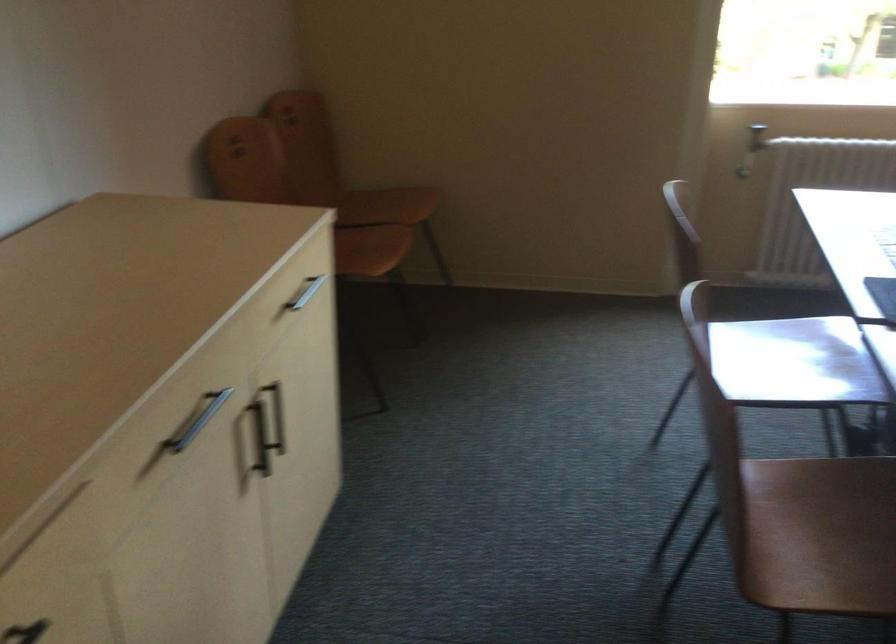
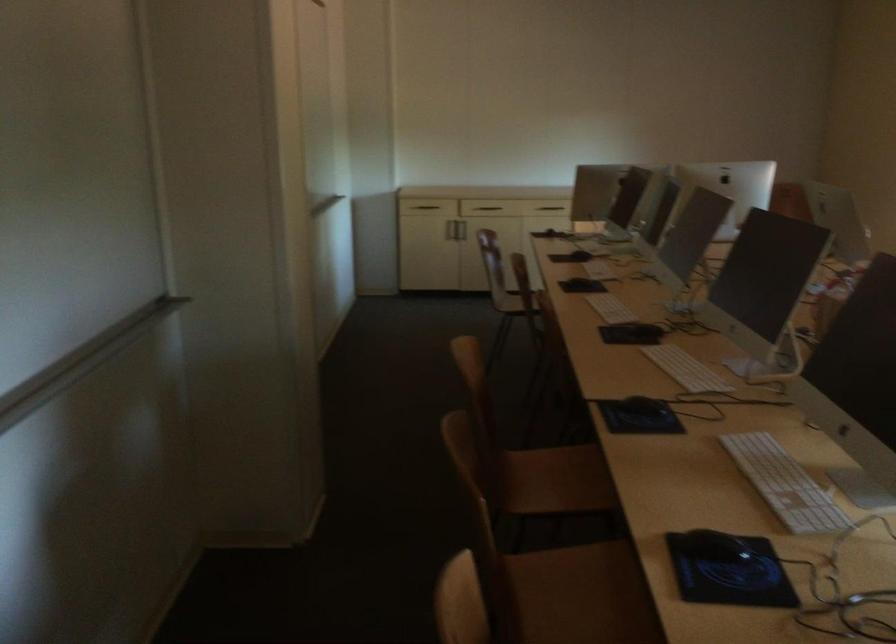
Question: I am providing you with two images of the same scene from different viewpoints. Please identify which objects are invisible in image2.

Choices:
 (A) green avocado
 (B) dark drawer handle
 (C) silver cabinet handle
 (D) black computer mouse

Answer: (C)